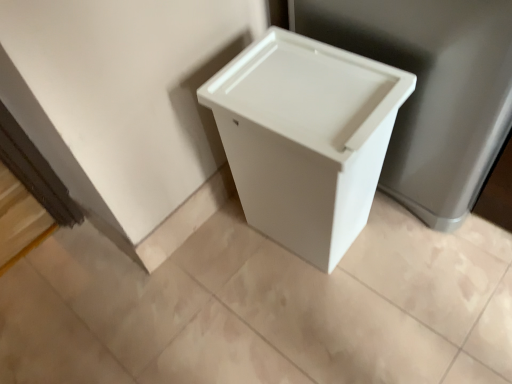
Image resolution: width=512 pixels, height=384 pixels. Describe the element at coordinates (306, 138) in the screenshot. I see `white plastic waste container at center` at that location.

Identify the location of white plastic waste container at center. (306, 138).

Image resolution: width=512 pixels, height=384 pixels. I want to click on white plastic trash can at center, so click(432, 91).

Image resolution: width=512 pixels, height=384 pixels. Describe the element at coordinates (432, 91) in the screenshot. I see `white plastic trash can at center` at that location.

Image resolution: width=512 pixels, height=384 pixels. Find the location of `white plastic waste container at center`. white plastic waste container at center is located at coordinates (306, 138).

Is white plastic trash can at center to the left of white plastic waste container at center from the viewer's perspective?

No, white plastic trash can at center is not to the left of white plastic waste container at center.

Is white plastic trash can at center in front of or behind white plastic waste container at center in the image?

Clearly, white plastic trash can at center is in front of white plastic waste container at center.

Considering the positions of points (394, 28) and (246, 186), is point (394, 28) closer to camera compared to point (246, 186)?

Yes, it is in front of point (246, 186).

From the image's perspective, would you say white plastic trash can at center is positioned over white plastic waste container at center?

Yes, from the image's perspective, white plastic trash can at center is over white plastic waste container at center.

From a real-world perspective, is white plastic trash can at center on white plastic waste container at center?

Correct, in the physical world, white plastic trash can at center is higher than white plastic waste container at center.

In the scene shown: Looking at their sizes, would you say white plastic trash can at center is wider or thinner than white plastic waste container at center?

white plastic trash can at center is wider than white plastic waste container at center.

Is white plastic trash can at center taller than white plastic waste container at center?

Yes, white plastic trash can at center is taller than white plastic waste container at center.

Is white plastic trash can at center bigger than white plastic waste container at center?

Yes, white plastic trash can at center is bigger than white plastic waste container at center.

Is white plastic waste container at center located within white plastic trash can at center?

No, white plastic trash can at center does not contain white plastic waste container at center.

Is white plastic trash can at center not close to white plastic waste container at center?

No, white plastic trash can at center is not far away from white plastic waste container at center.

Is white plastic waste container at center at the back of white plastic trash can at center?

No.

You are a GUI agent. You are given a task and a screenshot of the screen. Output one action in this format:
    pyautogui.click(x=<x>, y=<y>)
    Task: Click on the waste container below the white plastic trash can at center (from the image's perspective)
    This screenshot has width=512, height=384.
    Given the screenshot: What is the action you would take?
    pyautogui.click(x=306, y=138)

Which object is positioned more to the left, white plastic waste container at center or white plastic trash can at center?

Positioned to the left is white plastic waste container at center.

In the scene shown: Is white plastic waste container at center in front of or behind white plastic trash can at center in the image?

Visually, white plastic waste container at center is located behind white plastic trash can at center.

Which point is more distant from viewer, (383,91) or (439,14)?

The point (383,91) is more distant.

From the picture: From the image's perspective, which one is positioned lower, white plastic waste container at center or white plastic trash can at center?

white plastic waste container at center.

Consider the image. From a real-world perspective, is white plastic waste container at center above or below white plastic trash can at center?

From a real-world perspective, white plastic waste container at center is physically below white plastic trash can at center.

Between white plastic waste container at center and white plastic trash can at center, which one has smaller width?

Thinner between the two is white plastic waste container at center.

Is white plastic waste container at center shorter than white plastic trash can at center?

Correct, white plastic waste container at center is not as tall as white plastic trash can at center.

Consider the image. Between white plastic waste container at center and white plastic trash can at center, which one has smaller size?

With smaller size is white plastic waste container at center.

Is white plastic trash can at center surrounded by white plastic waste container at center?

No, white plastic waste container at center does not contain white plastic trash can at center.

Is white plastic waste container at center next to white plastic trash can at center and touching it?

No.

Does white plastic waste container at center turn towards white plastic trash can at center?

No, white plastic waste container at center does not turn towards white plastic trash can at center.

Locate an element on the screen. The height and width of the screenshot is (384, 512). waste container located underneath the white plastic trash can at center (from a real-world perspective) is located at coordinates (306, 138).

Identify the location of porcelain on the right of white plastic waste container at center. (432, 91).

Locate an element on the screen. The height and width of the screenshot is (384, 512). porcelain in front of the white plastic waste container at center is located at coordinates [x=432, y=91].